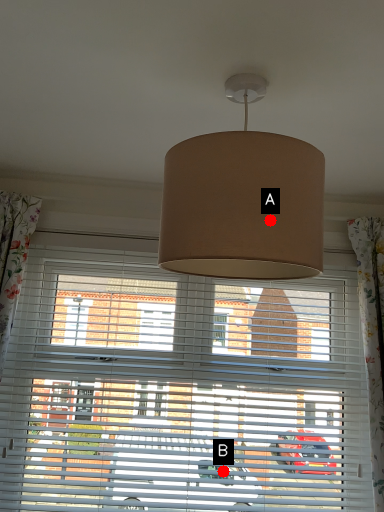
Question: Two points are circled on the image, labeled by A and B beside each circle. Which point is closer to the camera?

Choices:
 (A) A is closer
 (B) B is closer

Answer: (A)